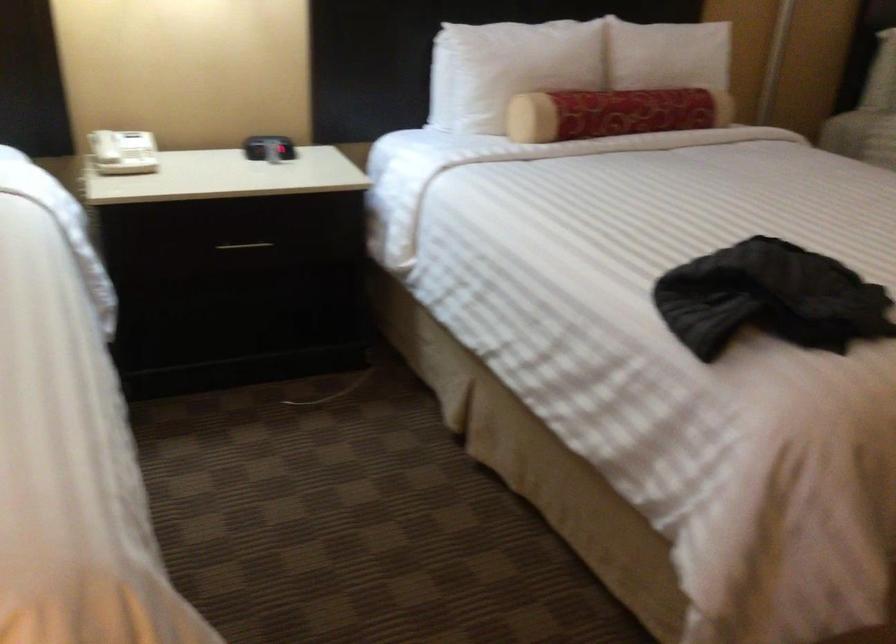
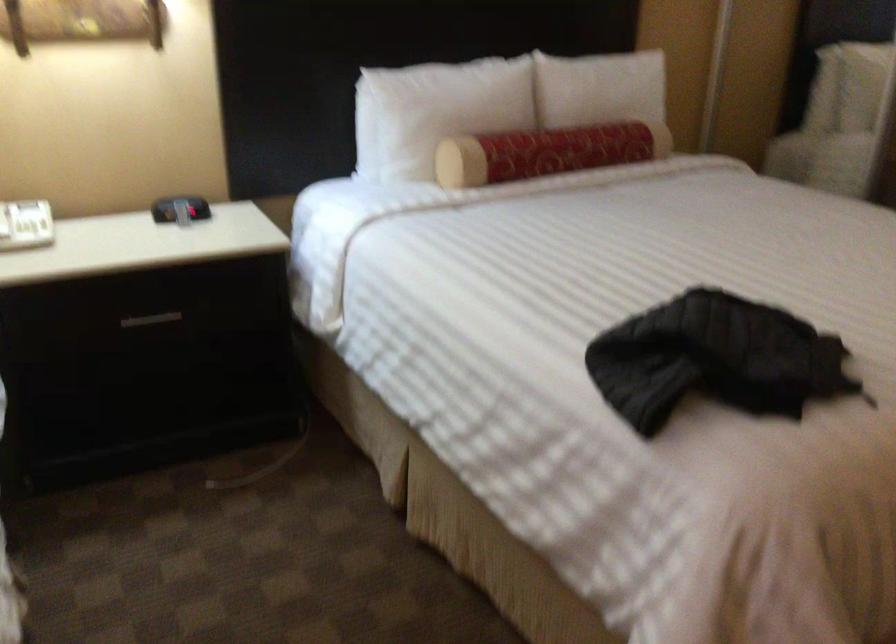
Locate, in the second image, the point that corresponds to (270,146) in the first image.

(179, 209)